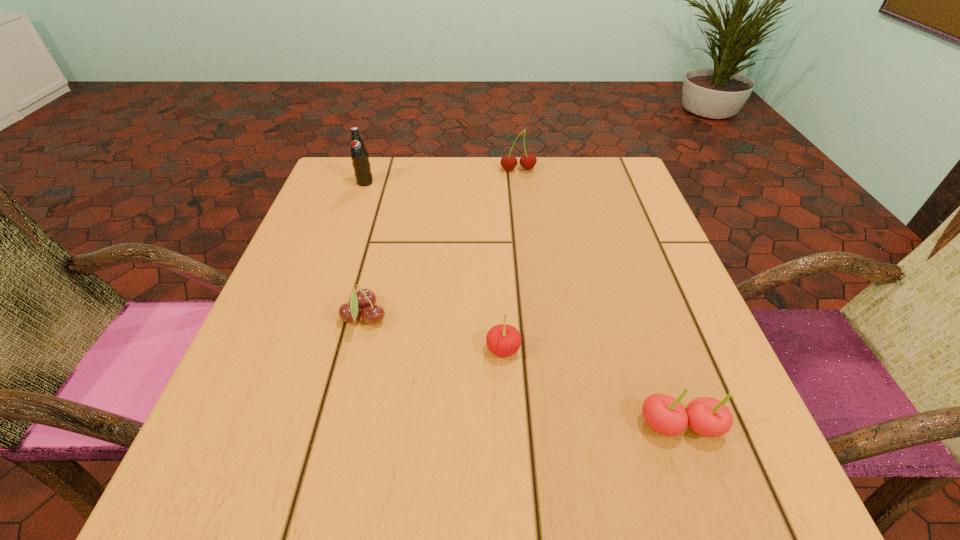
Where is `vacant space at the near edge`? This screenshot has height=540, width=960. vacant space at the near edge is located at coordinates (440, 455).

At what (x,y) coordinates should I click in order to perform the action: click on blank space at the left edge of the desktop. Please return your answer as a coordinate pair (x, y). Looking at the image, I should click on (324, 219).

What are the coordinates of `vacant area at the right edge` in the screenshot? It's located at (616, 266).

Identify the location of free space at the far left corner of the desktop. (376, 180).

In the image, there is a desktop. Identify the location of vacant space at the far right corner. (576, 173).

Find the location of a particular element. The height and width of the screenshot is (540, 960). blank region between the shortest cherry and the fourth nearest object is located at coordinates pyautogui.click(x=365, y=251).

The width and height of the screenshot is (960, 540). Identify the location of vacant region between the farthest object and the pop. (442, 177).

The height and width of the screenshot is (540, 960). What are the coordinates of `empty location between the nearest cherry and the farthest cherry` in the screenshot? It's located at (599, 298).

Locate an element on the screen. The image size is (960, 540). free space between the farthest cherry and the leftmost cherry is located at coordinates (442, 244).

This screenshot has height=540, width=960. Find the location of `free area in between the leftmost cherry and the pop`. free area in between the leftmost cherry and the pop is located at coordinates (x=365, y=251).